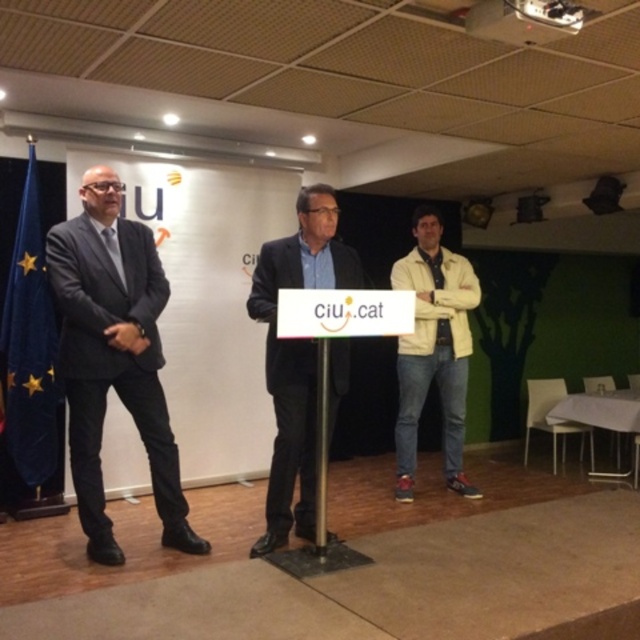
Question: Which point appears closest to the camera in this image?

Choices:
 (A) (285, 401)
 (B) (26, 257)
 (C) (432, 360)
 (D) (76, 248)

Answer: (D)

Question: Which of the following is the closest to the observer?

Choices:
 (A) (275, 378)
 (B) (76, 310)

Answer: (B)

Question: Does light beige jacket at center lie in front of blue fabric flag at left?

Choices:
 (A) yes
 (B) no

Answer: (A)

Question: Based on their relative distances, which object is nearer to the dark gray suit at left?

Choices:
 (A) dark suit at center
 (B) blue fabric flag at left
 (C) light beige jacket at center

Answer: (A)

Question: Does dark gray suit at left have a lesser width compared to blue fabric flag at left?

Choices:
 (A) yes
 (B) no

Answer: (B)

Question: Is dark suit at center positioned before blue fabric flag at left?

Choices:
 (A) no
 (B) yes

Answer: (B)